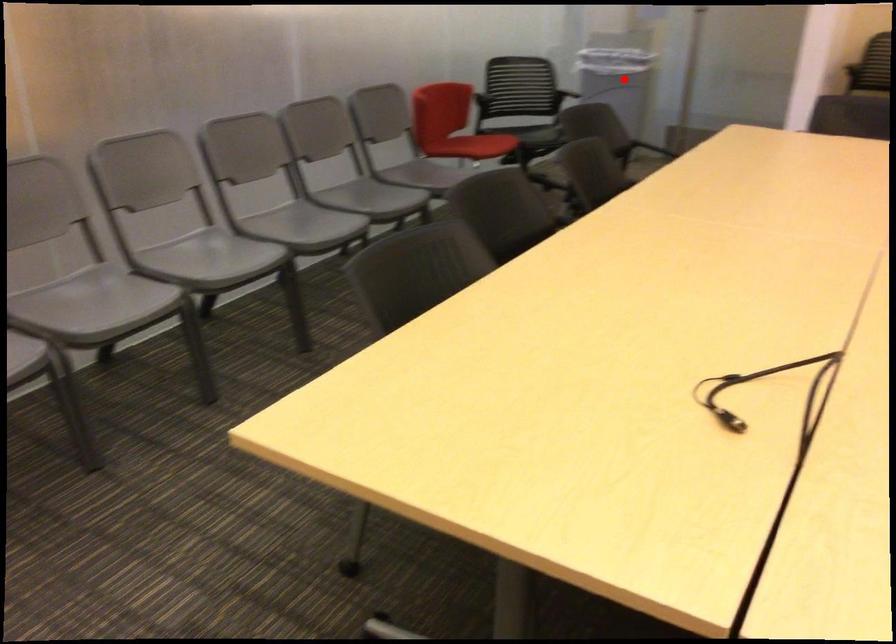
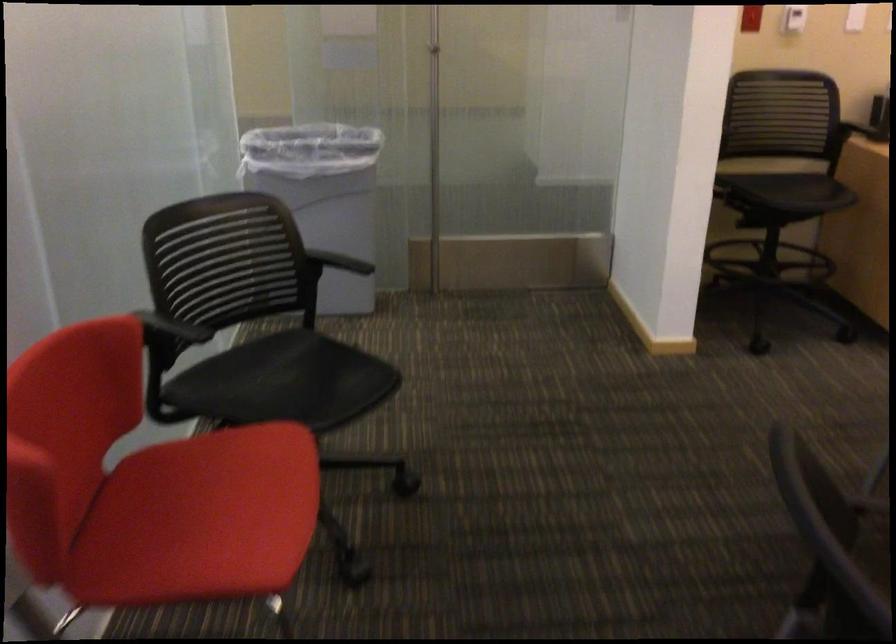
Question: I am providing you with two images of the same scene from different viewpoints. Given a red point in image1, look at the same physical point in image2. Is it:

Choices:
 (A) Closer to the viewpoint
 (B) Farther from the viewpoint

Answer: (A)